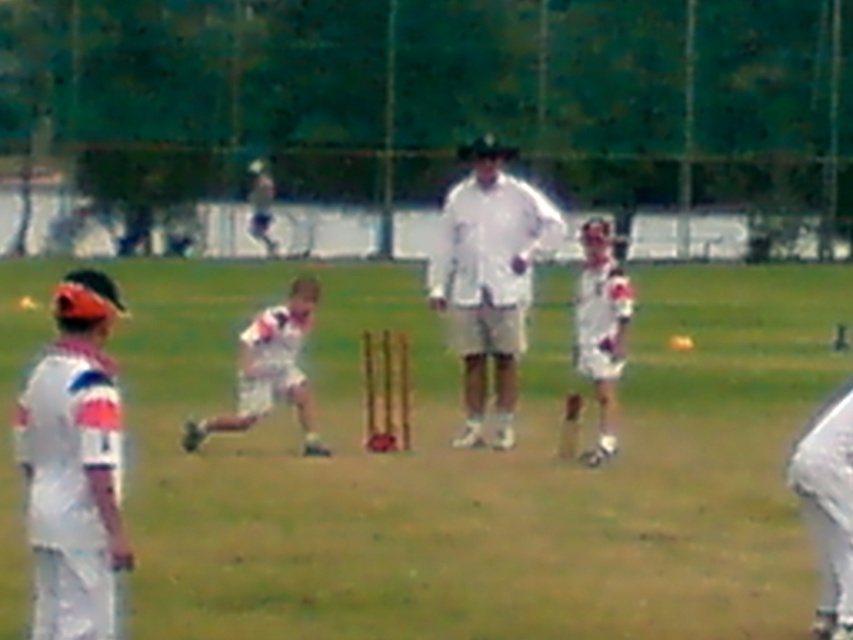
Question: Does white fabric uniform at center have a smaller size compared to white matte shirt at center?

Choices:
 (A) no
 (B) yes

Answer: (A)

Question: Estimate the real-world distances between objects in this image. Which object is farther from the white matte uniform at left?

Choices:
 (A) white matte shirt at center
 (B) white fabric shirt at center

Answer: (A)

Question: Which object appears closest to the camera in this image?

Choices:
 (A) white fabric uniform at center
 (B) white fabric shirt at center
 (C) white matte uniform at left
 (D) white matte shirt at center

Answer: (C)

Question: Is white fabric uniform at center smaller than white matte shirt at center?

Choices:
 (A) yes
 (B) no

Answer: (B)

Question: Can you confirm if white matte uniform at left is positioned to the right of white matte shirt at center?

Choices:
 (A) yes
 (B) no

Answer: (B)

Question: Which of the following is the closest to the observer?

Choices:
 (A) white fabric uniform at center
 (B) white matte uniform at left
 (C) white cotton shirt at center
 (D) white fabric shirt at center

Answer: (B)